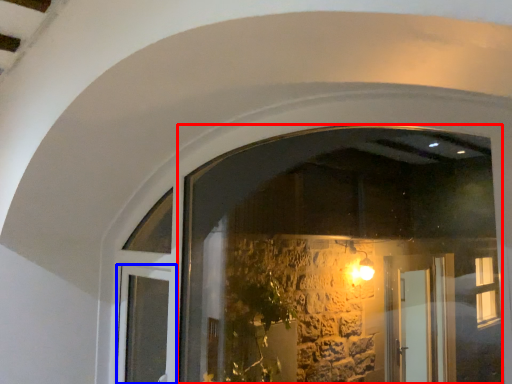
Question: Which point is closer to the camera, window (highlighted by a red box) or door (highlighted by a blue box)?

Choices:
 (A) window
 (B) door

Answer: (A)